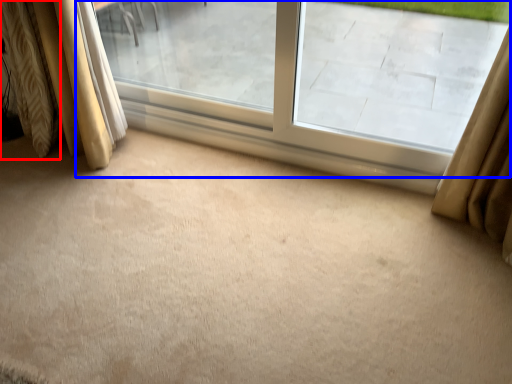
Question: Among these objects, which one is farthest to the camera, curtain (highlighted by a red box) or window (highlighted by a blue box)?

Choices:
 (A) curtain
 (B) window

Answer: (A)